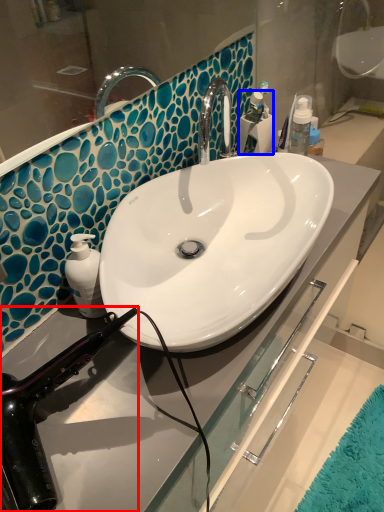
Question: Among these objects, which one is farthest to the camera, hair drier (highlighted by a red box) or toiletry (highlighted by a blue box)?

Choices:
 (A) hair drier
 (B) toiletry

Answer: (B)